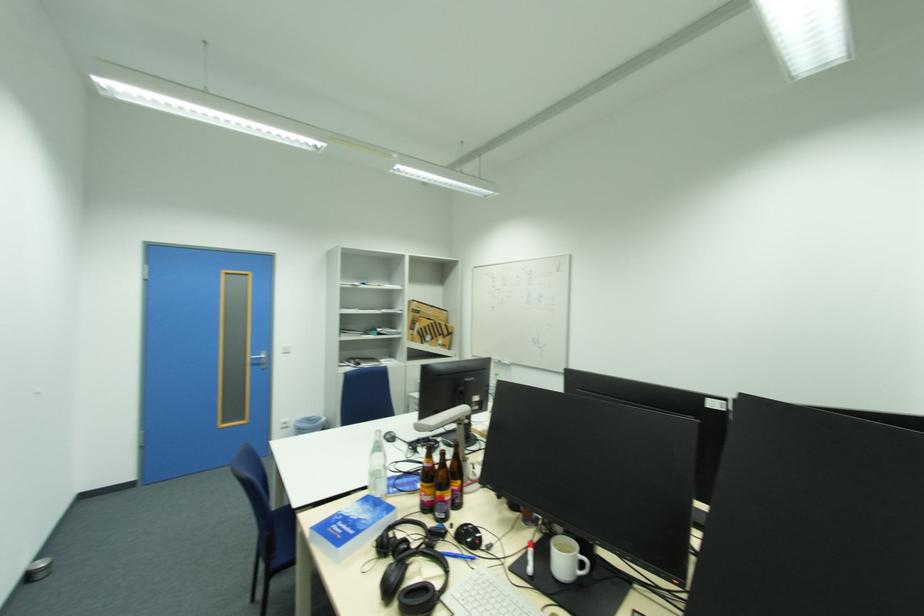
This screenshot has width=924, height=616. I want to click on black headphones, so click(410, 568).